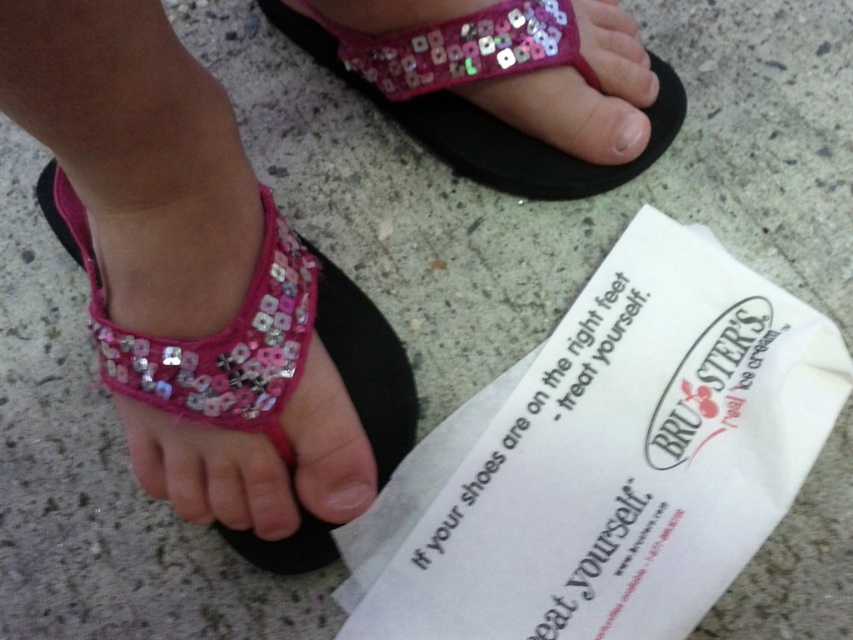
Question: Can you confirm if pink sequined sandal at center is positioned to the left of matte pink nail at center?

Choices:
 (A) no
 (B) yes

Answer: (B)

Question: Which of the following is the farthest from the observer?

Choices:
 (A) (671, 120)
 (B) (190, 433)

Answer: (A)

Question: Which of the following is the farthest from the observer?

Choices:
 (A) pink sequined sandal at upper center
 (B) pink sequined toe at center

Answer: (A)

Question: Does pink sequined sandal at center come in front of matte pink nail at center?

Choices:
 (A) no
 (B) yes

Answer: (B)

Question: Is pink sequined sandal at upper center further to camera compared to matte pink nail at center?

Choices:
 (A) yes
 (B) no

Answer: (A)

Question: Which object is positioned closest to the pink sequined sandal at center?

Choices:
 (A) matte pink nail at center
 (B) pink sequined toe at center

Answer: (B)